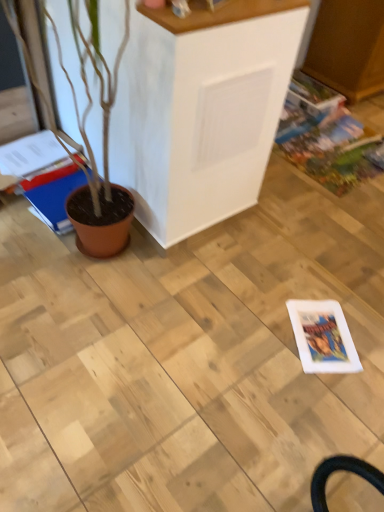
Question: From the image's perspective, is blue glossy magazine at left, the 2th magazine from the right, on top of matte brown magazine at left, which is the 2th magazine from left to right?

Choices:
 (A) yes
 (B) no

Answer: (A)

Question: Is blue glossy magazine at left, positioned as the first magazine in left-to-right order, positioned far away from matte brown magazine at left, which is counted as the 1th magazine, starting from the right?

Choices:
 (A) no
 (B) yes

Answer: (A)

Question: Is blue glossy magazine at left, positioned as the first magazine in left-to-right order, wider than matte brown magazine at left, which is the 2th magazine from left to right?

Choices:
 (A) no
 (B) yes

Answer: (B)

Question: Does blue glossy magazine at left, the 2th magazine from the right, appear on the left side of matte brown magazine at left, which is counted as the 1th magazine, starting from the right?

Choices:
 (A) yes
 (B) no

Answer: (A)

Question: Is the position of blue glossy magazine at left, positioned as the first magazine in left-to-right order, less distant than that of matte brown magazine at left, which is counted as the 1th magazine, starting from the right?

Choices:
 (A) no
 (B) yes

Answer: (A)

Question: From a real-world perspective, is multicolored glossy comic book at right above or below blue glossy magazine at left, positioned as the first magazine in left-to-right order?

Choices:
 (A) below
 (B) above

Answer: (A)

Question: Considering their positions, is multicolored glossy comic book at right located in front of or behind blue glossy magazine at left, the 2th magazine from the right?

Choices:
 (A) front
 (B) behind

Answer: (B)

Question: Based on their sizes in the image, would you say multicolored glossy comic book at right is bigger or smaller than blue glossy magazine at left, the 2th magazine from the right?

Choices:
 (A) small
 (B) big

Answer: (A)

Question: Considering the relative positions of multicolored glossy comic book at right and blue glossy magazine at left, the 2th magazine from the right, in the image provided, is multicolored glossy comic book at right to the left or to the right of blue glossy magazine at left, the 2th magazine from the right,?

Choices:
 (A) right
 (B) left

Answer: (A)

Question: Is point (48, 209) closer or farther from the camera than point (173, 152)?

Choices:
 (A) closer
 (B) farther

Answer: (B)

Question: From their relative heights in the image, would you say blue glossy magazine at left, the 2th magazine from the right, is taller or shorter than white matte cabinet at center?

Choices:
 (A) short
 (B) tall

Answer: (A)

Question: Which is correct: blue glossy magazine at left, positioned as the first magazine in left-to-right order, is inside white matte cabinet at center, or outside of it?

Choices:
 (A) outside
 (B) inside

Answer: (A)

Question: Considering the positions of blue glossy magazine at left, the 2th magazine from the right, and white matte cabinet at center in the image, is blue glossy magazine at left, the 2th magazine from the right, wider or thinner than white matte cabinet at center?

Choices:
 (A) wide
 (B) thin

Answer: (A)

Question: Is matte brown magazine at left, which is the 2th magazine from left to right, wider or thinner than multicolored glossy comic book at right?

Choices:
 (A) wide
 (B) thin

Answer: (B)

Question: Considering the positions of point (79, 175) and point (337, 195), is point (79, 175) closer or farther from the camera than point (337, 195)?

Choices:
 (A) closer
 (B) farther

Answer: (A)